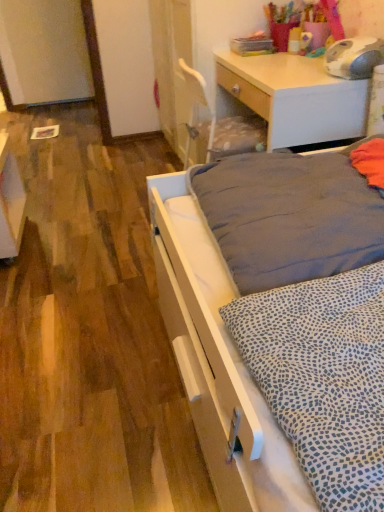
This screenshot has width=384, height=512. I want to click on white glossy vanity at lower left, so click(x=10, y=202).

What do you see at coordinates (289, 217) in the screenshot?
I see `dark gray fabric mattress at center` at bounding box center [289, 217].

Measure the distance between point (x=237, y=371) and camera.

Point (x=237, y=371) is 29.49 inches from camera.

The image size is (384, 512). What do you see at coordinates (295, 97) in the screenshot?
I see `light wood desk at upper right` at bounding box center [295, 97].

Measure the distance between point (216,53) and camera.

Point (216,53) is 2.04 meters from camera.

The image size is (384, 512). I want to click on white glossy vanity at lower left, so click(10, 202).

Considering the points (186, 182) and (285, 106), which point is in front, point (186, 182) or point (285, 106)?

Positioned in front is point (186, 182).

Could you tell me if white matte bed at lower right is facing light wood desk at upper right?

No, white matte bed at lower right is not oriented towards light wood desk at upper right.

Looking at this image, which object is wider, white matte bed at lower right or light wood desk at upper right?

white matte bed at lower right.

Based on the photo, is white matte bed at lower right behind light wood desk at upper right?

No.

Is point (280, 450) closer to camera compared to point (16, 161)?

Yes, point (280, 450) is closer to viewer.

In terms of width, does white matte bed at lower right look wider or thinner when compared to white glossy vanity at lower left?

Considering their sizes, white matte bed at lower right looks broader than white glossy vanity at lower left.

Can you confirm if white matte bed at lower right is bigger than white glossy vanity at lower left?

Correct, white matte bed at lower right is larger in size than white glossy vanity at lower left.

From a real-world perspective, between white matte bed at lower right and white glossy vanity at lower left, who is vertically higher?

white glossy vanity at lower left, from a real-world perspective.

Are white glossy vanity at lower left and dark gray fabric mattress at center making contact?

No.

From a real-world perspective, which is physically below, white glossy vanity at lower left or dark gray fabric mattress at center?

white glossy vanity at lower left, from a real-world perspective.

Considering the relative sizes of white glossy vanity at lower left and dark gray fabric mattress at center in the image provided, is white glossy vanity at lower left smaller than dark gray fabric mattress at center?

Yes.

Based on the photo, from the image's perspective, is white glossy vanity at lower left positioned above or below dark gray fabric mattress at center?

From the image's perspective, white glossy vanity at lower left appears above dark gray fabric mattress at center.

Is light wood desk at upper right far from white glossy vanity at lower left?

That's right, there is a large distance between light wood desk at upper right and white glossy vanity at lower left.

Is light wood desk at upper right taller than white glossy vanity at lower left?

Yes.

Considering the sizes of objects light wood desk at upper right and white glossy vanity at lower left in the image provided, who is bigger, light wood desk at upper right or white glossy vanity at lower left?

With larger size is light wood desk at upper right.

Is light wood desk at upper right positioned with its back to white glossy vanity at lower left?

That's not correct — light wood desk at upper right is not looking away from white glossy vanity at lower left.

Considering the positions of point (271, 482) and point (300, 219), is point (271, 482) closer or farther from the camera than point (300, 219)?

Clearly, point (271, 482) is closer to the camera than point (300, 219).

From a real-world perspective, is white matte bed at lower right on dark gray fabric mattress at center?

Incorrect, from a real-world perspective, white matte bed at lower right is lower than dark gray fabric mattress at center.

Consider the image. Can you confirm if white matte bed at lower right is bigger than dark gray fabric mattress at center?

Correct, white matte bed at lower right is larger in size than dark gray fabric mattress at center.

Which is more to the right, white matte bed at lower right or dark gray fabric mattress at center?

dark gray fabric mattress at center is more to the right.

From the image's perspective, is white glossy vanity at lower left below white matte bed at lower right?

Incorrect, from the image's perspective, white glossy vanity at lower left is higher than white matte bed at lower right.

How different are the orientations of white glossy vanity at lower left and white matte bed at lower right in degrees?

There is a 93.1-degree angle between the facing directions of white glossy vanity at lower left and white matte bed at lower right.

The height and width of the screenshot is (512, 384). I want to click on vanity to the left of white matte bed at lower right, so click(x=10, y=202).

Is dark gray fabric mattress at center surrounding light wood desk at upper right?

No.

From the image's perspective, which is above, dark gray fabric mattress at center or light wood desk at upper right?

light wood desk at upper right appears higher in the image.

Based on the photo, between dark gray fabric mattress at center and light wood desk at upper right, which one has larger size?

light wood desk at upper right.

Which object is wider, dark gray fabric mattress at center or light wood desk at upper right?

dark gray fabric mattress at center.

What are the coordinates of `desk behind the white matte bed at lower right` in the screenshot? It's located at (295, 97).

Where is `bed in front of the white glossy vanity at lower left`? bed in front of the white glossy vanity at lower left is located at coordinates (217, 359).

Which object lies further to the anchor point dark gray fabric mattress at center, white matte bed at lower right or white glossy vanity at lower left?

Among the two, white glossy vanity at lower left is located further to dark gray fabric mattress at center.

From the image, which object appears to be farther from dark gray fabric mattress at center, white glossy vanity at lower left or light wood desk at upper right?

Based on the image, white glossy vanity at lower left appears to be further to dark gray fabric mattress at center.

From the image, which object appears to be farther from white glossy vanity at lower left, light wood desk at upper right or white matte bed at lower right?

light wood desk at upper right.

Which object lies further to the anchor point light wood desk at upper right, dark gray fabric mattress at center or white glossy vanity at lower left?

white glossy vanity at lower left.

From the image, which object appears to be nearer to white matte bed at lower right, dark gray fabric mattress at center or white glossy vanity at lower left?

dark gray fabric mattress at center is positioned closer to the anchor white matte bed at lower right.

Looking at the image, which one is located closer to dark gray fabric mattress at center, white matte bed at lower right or light wood desk at upper right?

The object closer to dark gray fabric mattress at center is white matte bed at lower right.

Which object lies further to the anchor point white glossy vanity at lower left, light wood desk at upper right or dark gray fabric mattress at center?

Among the two, dark gray fabric mattress at center is located further to white glossy vanity at lower left.

Looking at the image, which one is located further to dark gray fabric mattress at center, light wood desk at upper right or white matte bed at lower right?

The object further to dark gray fabric mattress at center is light wood desk at upper right.

In order to click on mattress between white matte bed at lower right and light wood desk at upper right in the horizontal direction in this screenshot , I will do `click(289, 217)`.

The image size is (384, 512). I want to click on bed between white glossy vanity at lower left and light wood desk at upper right, so click(217, 359).

The width and height of the screenshot is (384, 512). Identify the location of bed between white glossy vanity at lower left and dark gray fabric mattress at center in the horizontal direction. (217, 359).

Locate an element on the screen. The height and width of the screenshot is (512, 384). mattress between white glossy vanity at lower left and light wood desk at upper right from left to right is located at coordinates (289, 217).